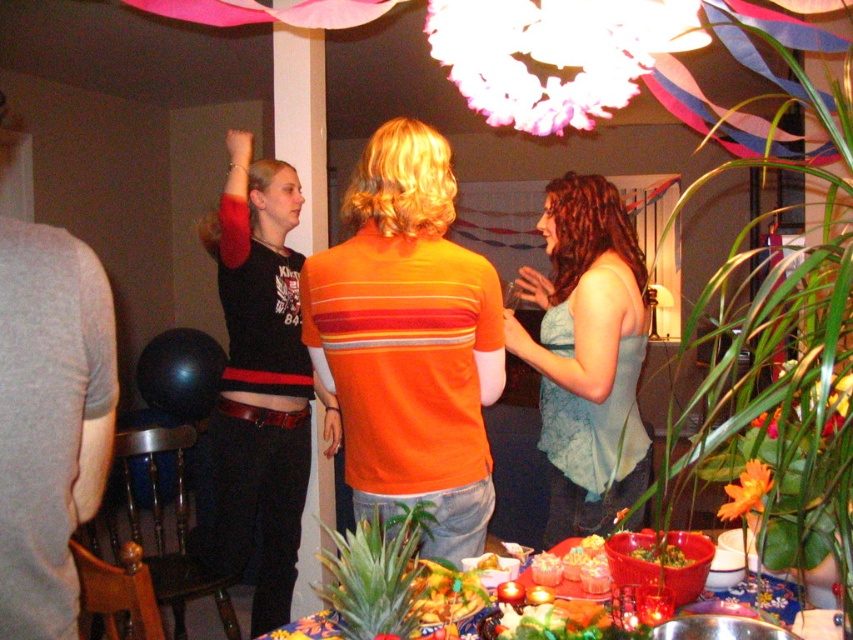
Question: Which point is farther to the camera?

Choices:
 (A) (651, 552)
 (B) (32, 433)

Answer: (A)

Question: Which of the following is the closest to the observer?

Choices:
 (A) (648, 550)
 (B) (486, 611)
 (C) (376, 211)

Answer: (B)

Question: Does matte black shirt at upper left appear on the right side of smooth wooden table at center?

Choices:
 (A) no
 (B) yes

Answer: (A)

Question: Does orange striped shirt at center lie in front of smooth red bowl at center?

Choices:
 (A) no
 (B) yes

Answer: (A)

Question: Observing the image, what is the correct spatial positioning of smooth red bowl at center in reference to yellow matte pineapple at center?

Choices:
 (A) below
 (B) above

Answer: (B)

Question: Which point is closer to the camera taking this photo?

Choices:
 (A) (744, 586)
 (B) (292, 416)
 (C) (556, 225)

Answer: (A)